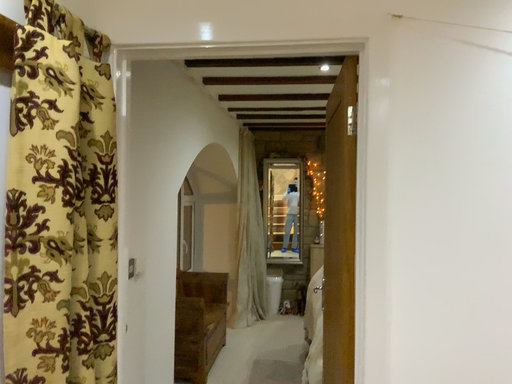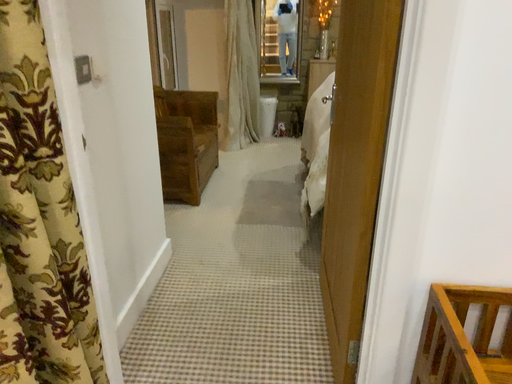
Question: Which way did the camera rotate in the video?

Choices:
 (A) rotated upward
 (B) rotated downward

Answer: (B)